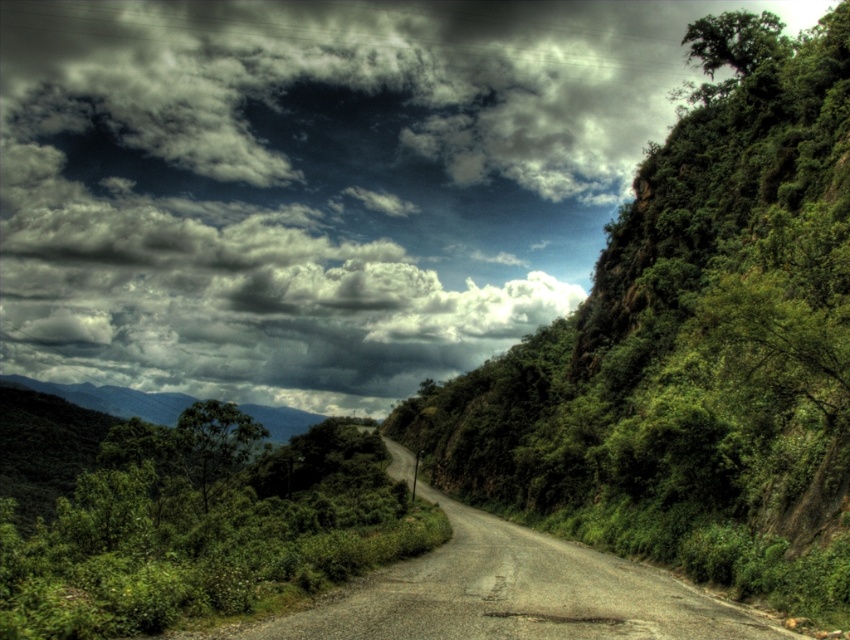
Can you confirm if cloudy sky at upper center is thinner than gravel road at center?

No, cloudy sky at upper center is not thinner than gravel road at center.

Can you confirm if cloudy sky at upper center is taller than gravel road at center?

Yes.

Image resolution: width=850 pixels, height=640 pixels. Describe the element at coordinates (310, 184) in the screenshot. I see `cloudy sky at upper center` at that location.

The image size is (850, 640). I want to click on cloudy sky at upper center, so click(310, 184).

Is point (364, 548) behind point (525, 545)?

That is False.

Can you confirm if green leafy shrubs at center is wider than gravel road at center?

Correct, the width of green leafy shrubs at center exceeds that of gravel road at center.

Does point (88, 468) come farther from viewer compared to point (709, 605)?

Yes, point (88, 468) is farther from viewer.

This screenshot has width=850, height=640. What are the coordinates of `green leafy shrubs at center` in the screenshot? It's located at (188, 516).

Can you confirm if cloudy sky at upper center is smaller than green leafy shrubs at center?

Incorrect, cloudy sky at upper center is not smaller in size than green leafy shrubs at center.

Is point (200, 326) positioned after point (21, 604)?

Yes, point (200, 326) is farther from viewer.

Where is `cloudy sky at upper center`? The image size is (850, 640). cloudy sky at upper center is located at coordinates (310, 184).